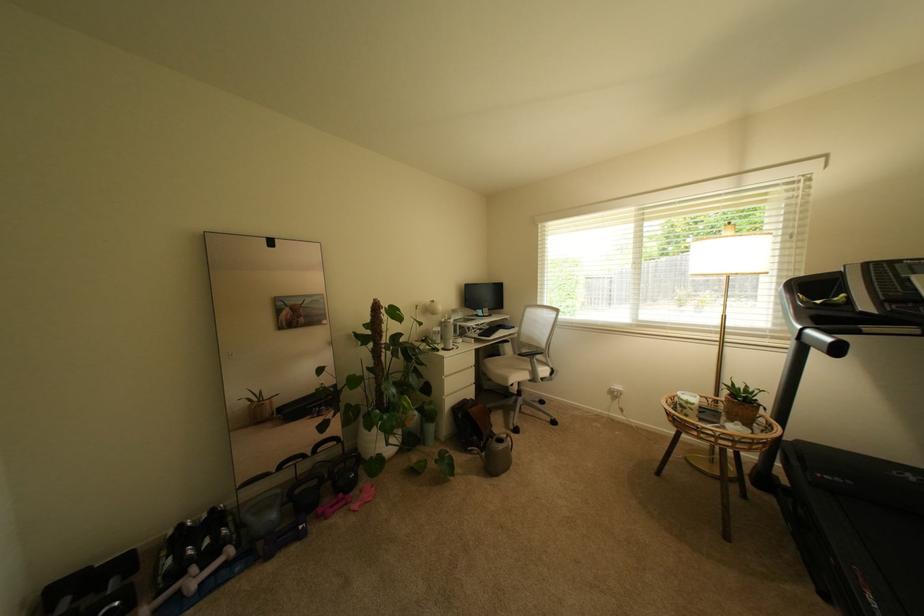
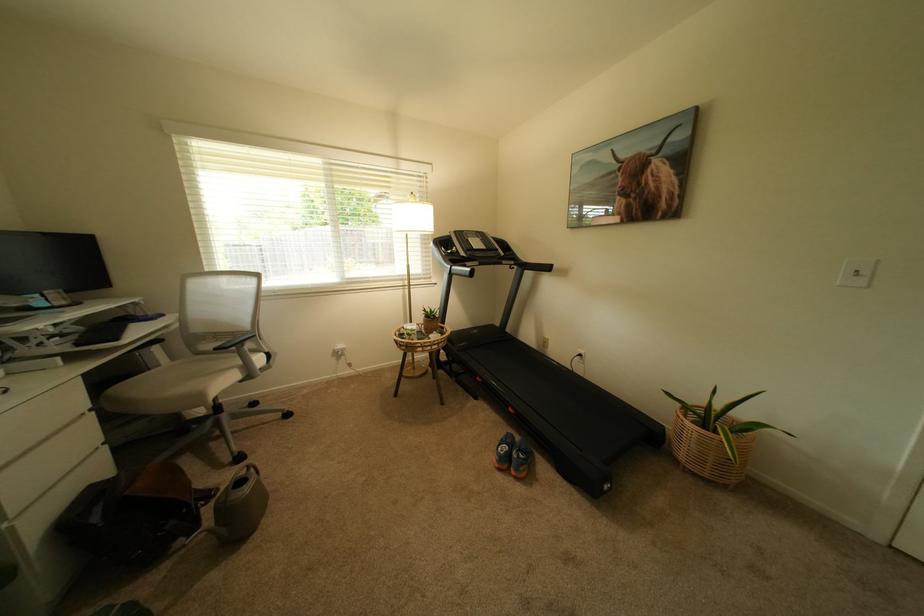
In the second image, find the point that corresponds to (514,437) in the first image.

(253, 471)